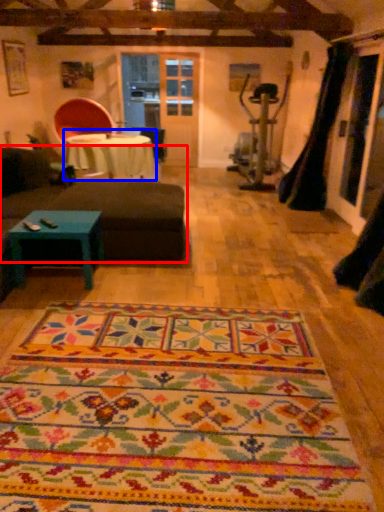
Question: Which object appears closest to the camera in this image, studio couch (highlighted by a red box) or table (highlighted by a blue box)?

Choices:
 (A) studio couch
 (B) table

Answer: (A)